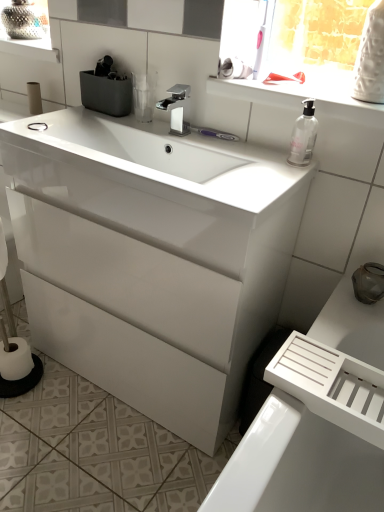
Question: From the image's perspective, is white matte toilet paper at left, which is the 2th toilet paper from right to left, above white matte toilet paper at upper center, marked as the second toilet paper in a top-to-bottom arrangement?

Choices:
 (A) yes
 (B) no

Answer: (A)

Question: Could white matte toilet paper at upper center, marked as the second toilet paper in a top-to-bottom arrangement, be considered to be inside white matte toilet paper at left, which is counted as the 3th toilet paper, starting from the bottom?

Choices:
 (A) no
 (B) yes

Answer: (A)

Question: From a real-world perspective, is white matte toilet paper at left, positioned as the first toilet paper in back-to-front order, physically below white matte toilet paper at upper center, acting as the 1th toilet paper starting from the right?

Choices:
 (A) yes
 (B) no

Answer: (A)

Question: Is white matte toilet paper at left, which is counted as the 3th toilet paper, starting from the bottom, directly adjacent to white matte toilet paper at upper center, which is the 3th toilet paper in left-to-right order?

Choices:
 (A) yes
 (B) no

Answer: (B)

Question: From the image's perspective, does white matte toilet paper at left, the 3th toilet paper when ordered from front to back, appear lower than white matte toilet paper at upper center, marked as the second toilet paper in a top-to-bottom arrangement?

Choices:
 (A) yes
 (B) no

Answer: (B)

Question: Considering the relative sizes of white matte toilet paper at left, positioned as the first toilet paper in back-to-front order, and white matte toilet paper at upper center, which ranks as the third toilet paper in back-to-front order, in the image provided, is white matte toilet paper at left, positioned as the first toilet paper in back-to-front order, wider than white matte toilet paper at upper center, which ranks as the third toilet paper in back-to-front order,?

Choices:
 (A) no
 (B) yes

Answer: (A)

Question: Does polished chrome faucet at center have a greater width compared to white glossy cabinet at center?

Choices:
 (A) no
 (B) yes

Answer: (A)

Question: Can you confirm if polished chrome faucet at center is taller than white glossy cabinet at center?

Choices:
 (A) no
 (B) yes

Answer: (A)

Question: Does polished chrome faucet at center have a smaller size compared to white glossy cabinet at center?

Choices:
 (A) no
 (B) yes

Answer: (B)

Question: From the image's perspective, is polished chrome faucet at center beneath white glossy cabinet at center?

Choices:
 (A) no
 (B) yes

Answer: (A)

Question: Considering the relative sizes of polished chrome faucet at center and white glossy cabinet at center in the image provided, is polished chrome faucet at center shorter than white glossy cabinet at center?

Choices:
 (A) yes
 (B) no

Answer: (A)

Question: Is polished chrome faucet at center at the left side of white glossy cabinet at center?

Choices:
 (A) yes
 (B) no

Answer: (B)

Question: Does white glossy cabinet at center have a smaller size compared to white matte toilet paper at left, the 2th toilet paper positioned from the left?

Choices:
 (A) yes
 (B) no

Answer: (B)